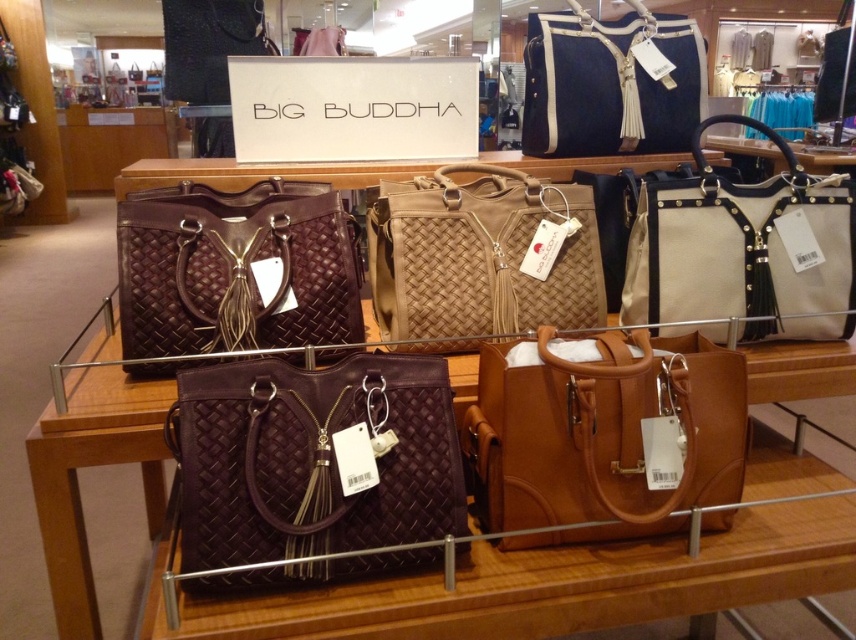
You are a customer in the store and want to know which bag is taller between the matte woven tote at center and the matte brown leather handbag at center. Can you tell me?

The matte brown leather handbag at center is taller than the matte woven tote at center.